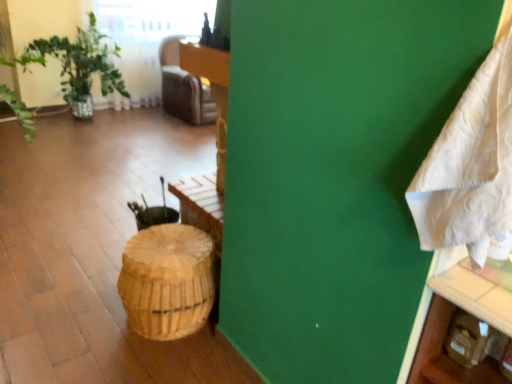
Question: Is white textured blanket at right inside the boundaries of brown woven basket at center, or outside?

Choices:
 (A) outside
 (B) inside

Answer: (A)

Question: Is point (501, 175) closer or farther from the camera than point (163, 248)?

Choices:
 (A) closer
 (B) farther

Answer: (A)

Question: From the image's perspective, is white textured blanket at right positioned above or below brown woven basket at center?

Choices:
 (A) below
 (B) above

Answer: (B)

Question: Is brown woven basket at center wider or thinner than white textured blanket at right?

Choices:
 (A) wide
 (B) thin

Answer: (A)

Question: Is brown woven basket at center to the left or to the right of white textured blanket at right in the image?

Choices:
 (A) right
 (B) left

Answer: (B)

Question: Is point (161, 266) positioned closer to the camera than point (510, 183)?

Choices:
 (A) closer
 (B) farther

Answer: (B)

Question: Considering their positions, is brown woven basket at center located in front of or behind white textured blanket at right?

Choices:
 (A) behind
 (B) front

Answer: (A)